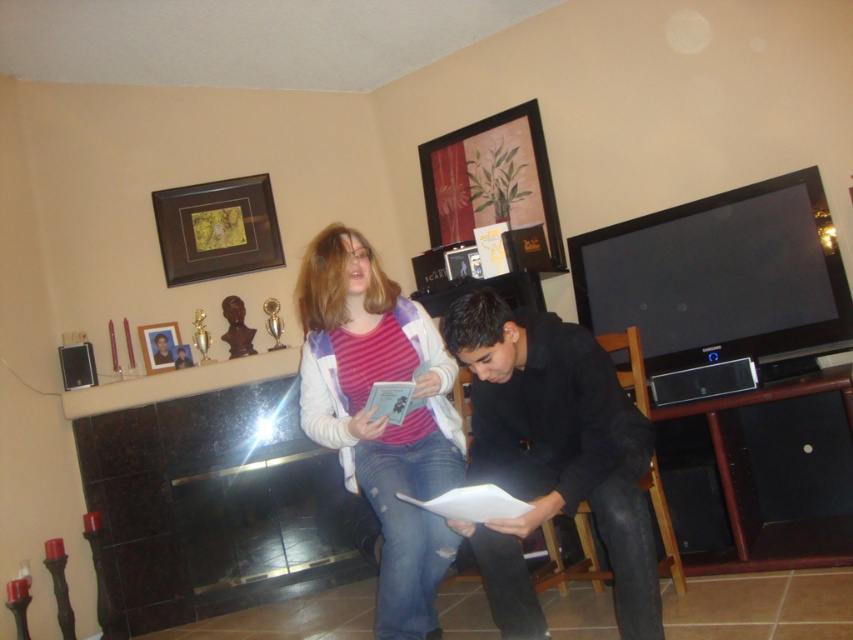
You are an interior designer assessing the placement of frames on the fireplace. You need to determine if the brown wooden picture frame at upper left is taller than the wooden photo frame at upper left. Based on the scene description, can you confirm this?

Yes, the brown wooden picture frame at upper left is much taller than the wooden photo frame at upper left according to the description provided.